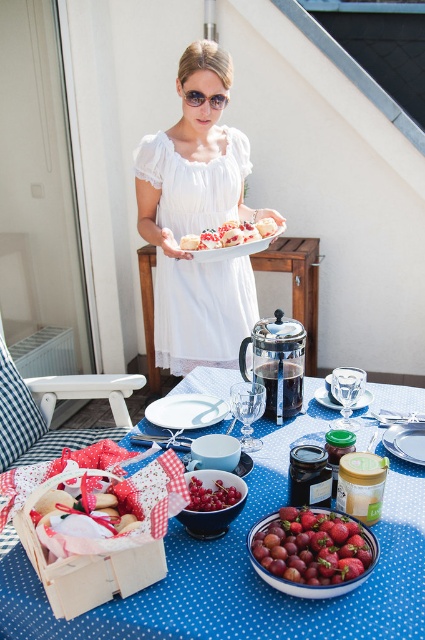
Question: Estimate the real-world distances between objects in this image. Which object is closer to the transparent glass picnic table at center?

Choices:
 (A) blue polka dot tablecloth at center
 (B) matte glass plate at center

Answer: (A)

Question: Is blue polka dot tablecloth at center thinner than white lace dress at center?

Choices:
 (A) no
 (B) yes

Answer: (A)

Question: Which object is positioned closest to the white matte plate at center?

Choices:
 (A) white lace dress at center
 (B) transparent glass picnic table at center
 (C) matte glass plate at center
 (D) shiny red strawberries at center

Answer: (C)

Question: Observing the image, what is the correct spatial positioning of transparent glass picnic table at center in reference to white matte plate at center?

Choices:
 (A) left
 (B) right

Answer: (B)

Question: Which object is farther from the camera taking this photo?

Choices:
 (A) glossy red grapes at center
 (B) transparent glass picnic table at center

Answer: (B)

Question: Does matte glass plate at center appear on the right side of clear glass platter at center?

Choices:
 (A) yes
 (B) no

Answer: (A)